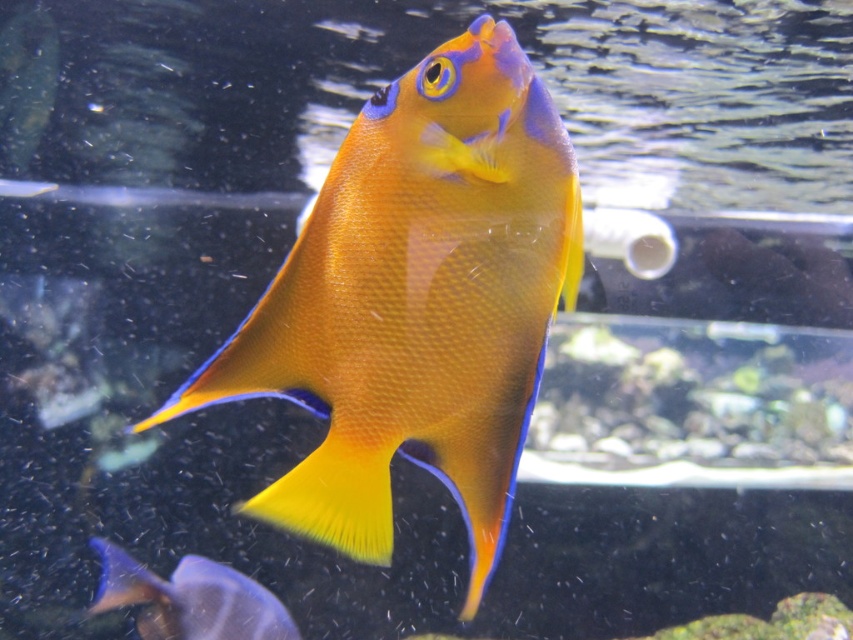
Question: Among these points, which one is nearest to the camera?

Choices:
 (A) (311, 321)
 (B) (186, 586)

Answer: (A)

Question: Among these objects, which one is farthest from the camera?

Choices:
 (A) matte orange fish at center
 (B) blue glossy fish at lower left

Answer: (B)

Question: Is matte orange fish at center closer to camera compared to blue glossy fish at lower left?

Choices:
 (A) no
 (B) yes

Answer: (B)

Question: Does matte orange fish at center appear over blue glossy fish at lower left?

Choices:
 (A) no
 (B) yes

Answer: (B)

Question: Is matte orange fish at center closer to the viewer compared to blue glossy fish at lower left?

Choices:
 (A) yes
 (B) no

Answer: (A)

Question: Which object is farther from the camera taking this photo?

Choices:
 (A) matte orange fish at center
 (B) blue glossy fish at lower left

Answer: (B)